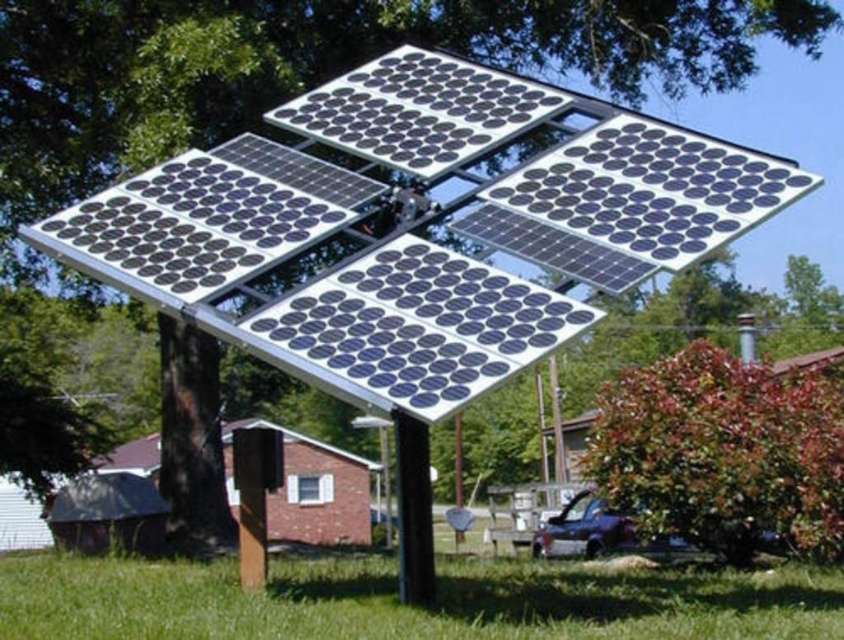
You are standing at the base of the solar panel framework and want to place a new solar panel at point [723,452]. Is there enough space there?

The point [723,452] is occupied by a green leafy tree at lower right, so there is no space to place the new solar panel there.